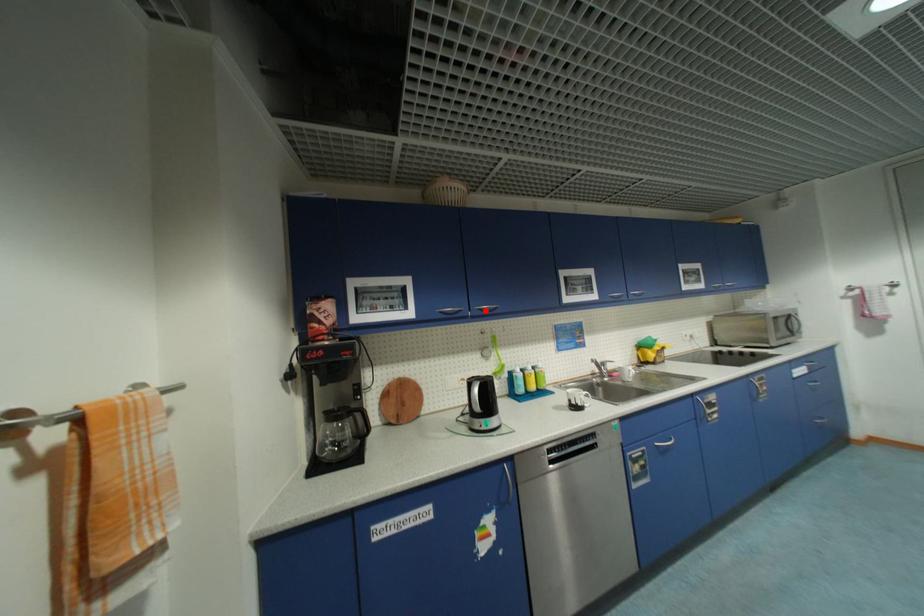
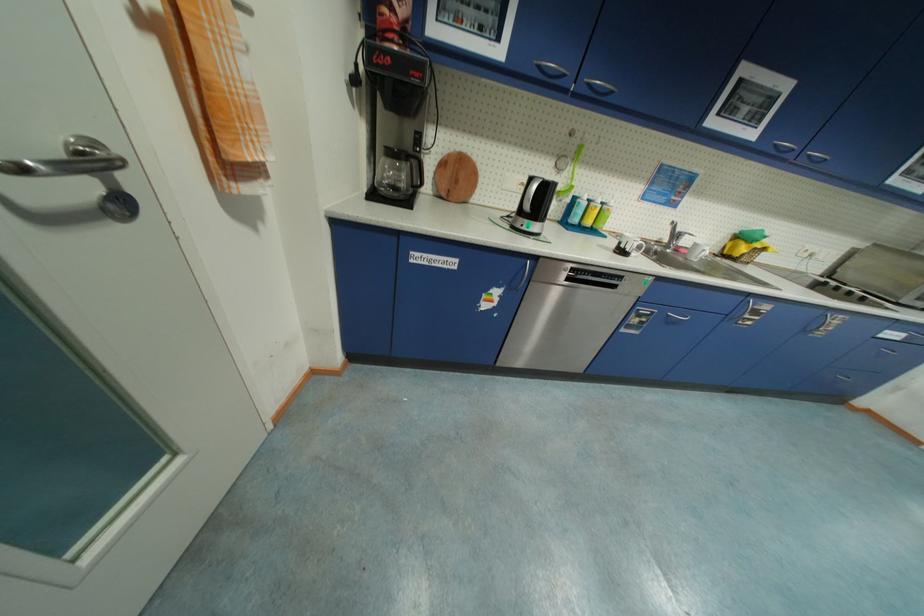
Question: I am providing you with two images of the same scene from different viewpoints. A red point is marked on the first image. Can you still see the location of the red point in image 2?

Choices:
 (A) Yes
 (B) No

Answer: (A)